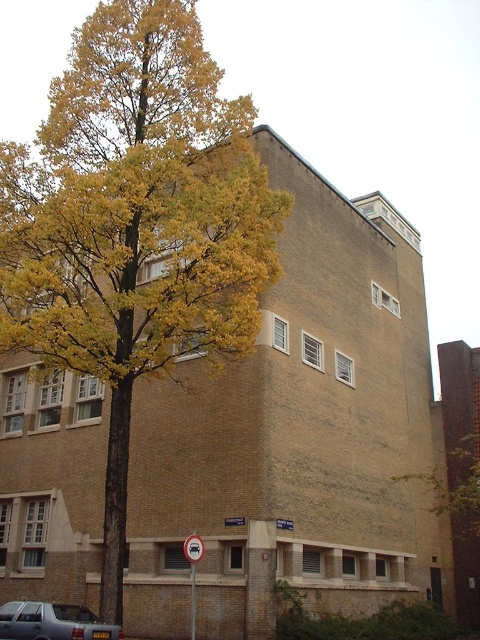
Question: Can you confirm if yellow leafy tree at upper left is smaller than silver metallic car at lower left?

Choices:
 (A) yes
 (B) no

Answer: (B)

Question: Which point appears farthest from the camera in this image?

Choices:
 (A) (60, 358)
 (B) (475, 436)
 (C) (31, 634)

Answer: (B)

Question: Which point is farther from the camera taking this photo?

Choices:
 (A) (444, 496)
 (B) (202, 292)
 (C) (121, 628)

Answer: (A)

Question: Which point appears farthest from the camera in this image?

Choices:
 (A) (58, 612)
 (B) (74, 161)

Answer: (B)

Question: Does yellow-green leaves at center have a lesser width compared to yellow leafy tree at upper left?

Choices:
 (A) yes
 (B) no

Answer: (B)

Question: In this image, where is yellow leafy tree at upper left located relative to silver metallic car at lower left?

Choices:
 (A) left
 (B) right

Answer: (B)